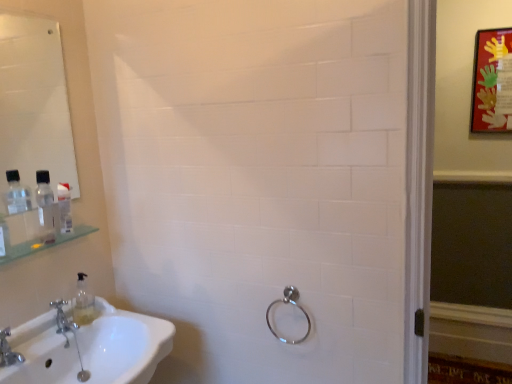
Question: Is point (32, 144) closer or farther from the camera than point (5, 352)?

Choices:
 (A) closer
 (B) farther

Answer: (B)

Question: Is white glossy mirror at upper left wider or thinner than brushed metal faucet at lower left, the first tap when ordered from front to back?

Choices:
 (A) wide
 (B) thin

Answer: (B)

Question: Estimate the real-world distances between objects in this image. Which object is farther from the polished chrome towel ring at lower center?

Choices:
 (A) matte red picture frame at upper right
 (B) silver metallic faucet at lower left, positioned as the 2th tap in front-to-back order
 (C) white glossy mirror at upper left
 (D) clear plastic bottle at left
 (E) white glossy sink at lower left

Answer: (A)

Question: Which object is the closest to the white glossy sink at lower left?

Choices:
 (A) clear glass shelf at left
 (B) brushed metal faucet at lower left, the 1th tap in the left-to-right sequence
 (C) polished chrome towel ring at lower center
 (D) silver metallic faucet at lower left, positioned as the 2th tap in front-to-back order
 (E) clear plastic bottle at left

Answer: (D)